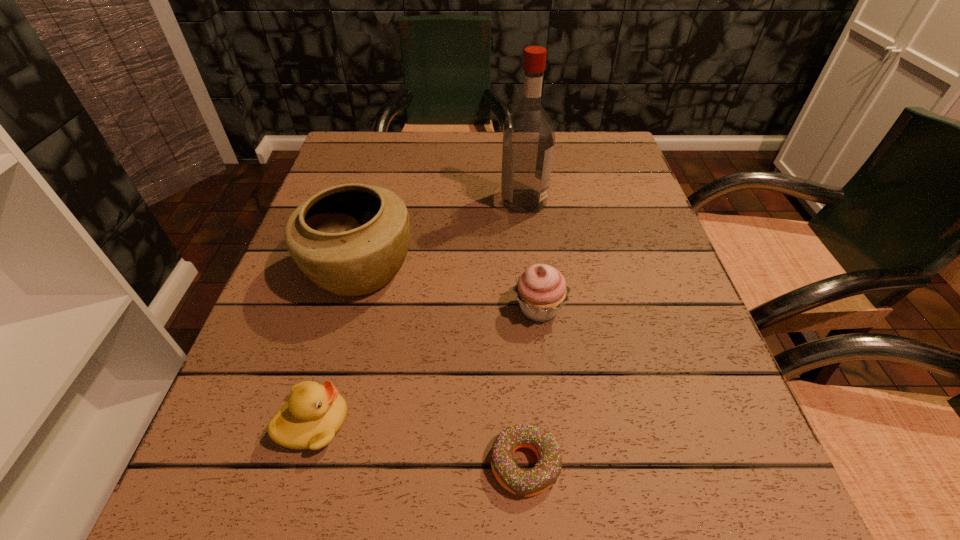
The width and height of the screenshot is (960, 540). I want to click on vacant space at the far left corner of the desktop, so click(357, 172).

Locate an element on the screen. This screenshot has width=960, height=540. free space at the far right corner of the desktop is located at coordinates (598, 160).

Identify the location of vacant region between the pottery and the third shortest object. Image resolution: width=960 pixels, height=540 pixels. (449, 289).

Image resolution: width=960 pixels, height=540 pixels. In order to click on free space between the pottery and the cupcake in this screenshot , I will do `click(449, 289)`.

Identify the location of free area in between the fourth shortest object and the farthest object. The width and height of the screenshot is (960, 540). (442, 235).

At what (x,y) coordinates should I click in order to perform the action: click on vacant point located between the shortest object and the liquor. Please return your answer as a coordinate pair (x, y). The height and width of the screenshot is (540, 960). Looking at the image, I should click on (524, 333).

Locate an element on the screen. The image size is (960, 540). free space between the third tallest object and the second shortest object is located at coordinates (426, 366).

Identify the location of free spot between the doughnut and the pottery. Image resolution: width=960 pixels, height=540 pixels. 442,367.

Where is `vacant point located between the liquor and the doughnut`? Image resolution: width=960 pixels, height=540 pixels. vacant point located between the liquor and the doughnut is located at coordinates (524, 333).

Where is `vacant area between the second tallest object and the doughnut`? The height and width of the screenshot is (540, 960). vacant area between the second tallest object and the doughnut is located at coordinates (442, 367).